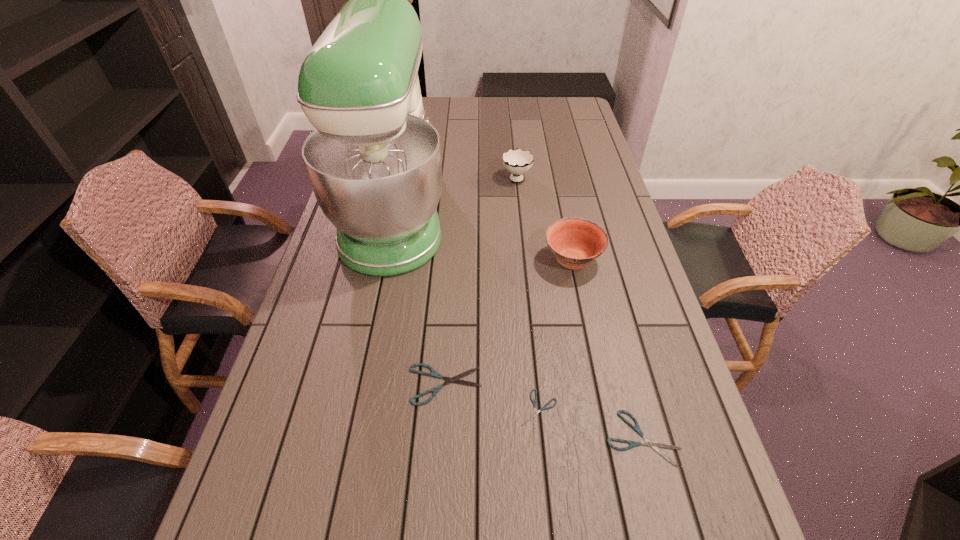
Given the evenly spaced shearss in the image, where should an extra shears be added on the left to preserve the spacing? Please point to a vacant space. Please provide its 2D coordinates. Your answer should be formatted as a tuple, i.e. [(x, y)], where the tuple contains the x and y coordinates of a point satisfying the conditions above.

[(359, 361)]